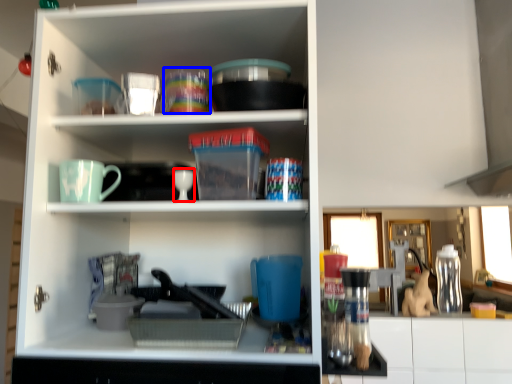
Question: Which object appears closest to the camera in this image, tableware (highlighted by a red box) or tableware (highlighted by a blue box)?

Choices:
 (A) tableware
 (B) tableware

Answer: (A)